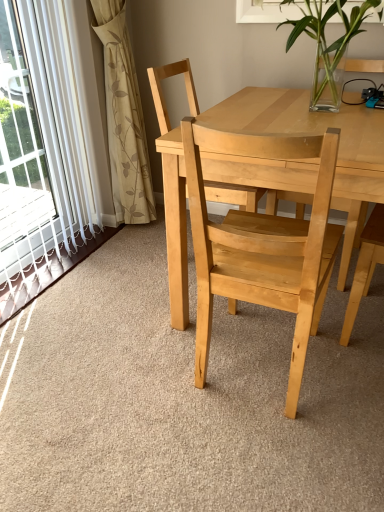
Question: Does natural wood chair at center, placed as the first chair when sorted from front to back, touch natural wood chair at center, marked as the 2th chair in a front-to-back arrangement?

Choices:
 (A) yes
 (B) no

Answer: (B)

Question: Would you say natural wood chair at center, the 1th chair viewed from the back, is part of natural wood chair at center, placed as the first chair when sorted from front to back,'s contents?

Choices:
 (A) yes
 (B) no

Answer: (B)

Question: Considering the relative sizes of natural wood chair at center, placed as the first chair when sorted from front to back, and natural wood chair at center, the 1th chair viewed from the back, in the image provided, is natural wood chair at center, placed as the first chair when sorted from front to back, taller than natural wood chair at center, the 1th chair viewed from the back,?

Choices:
 (A) yes
 (B) no

Answer: (B)

Question: Is natural wood chair at center, placed as the first chair when sorted from front to back, shorter than natural wood chair at center, marked as the 2th chair in a front-to-back arrangement?

Choices:
 (A) yes
 (B) no

Answer: (A)

Question: Is natural wood chair at center, the 2th chair when ordered from back to front, positioned far away from natural wood chair at center, marked as the 2th chair in a front-to-back arrangement?

Choices:
 (A) no
 (B) yes

Answer: (A)

Question: Is natural wood chair at center, the 2th chair when ordered from back to front, smaller than natural wood chair at center, the 1th chair viewed from the back?

Choices:
 (A) no
 (B) yes

Answer: (A)

Question: Could you tell me if natural wood chair at center, the 2th chair when ordered from back to front, is facing beige floral fabric curtain at left?

Choices:
 (A) yes
 (B) no

Answer: (B)

Question: From the image's perspective, is natural wood chair at center, placed as the first chair when sorted from front to back, above beige floral fabric curtain at left?

Choices:
 (A) yes
 (B) no

Answer: (B)

Question: Can you confirm if natural wood chair at center, the 2th chair when ordered from back to front, is smaller than beige floral fabric curtain at left?

Choices:
 (A) no
 (B) yes

Answer: (A)

Question: Is natural wood chair at center, placed as the first chair when sorted from front to back, outside beige floral fabric curtain at left?

Choices:
 (A) no
 (B) yes

Answer: (B)

Question: From a real-world perspective, does natural wood chair at center, the 2th chair when ordered from back to front, sit lower than beige floral fabric curtain at left?

Choices:
 (A) yes
 (B) no

Answer: (A)

Question: From the image's perspective, is natural wood chair at center, placed as the first chair when sorted from front to back, under beige floral fabric curtain at left?

Choices:
 (A) yes
 (B) no

Answer: (A)

Question: Is clear glass vase at upper center smaller than natural wood chair at center, marked as the 2th chair in a front-to-back arrangement?

Choices:
 (A) no
 (B) yes

Answer: (B)